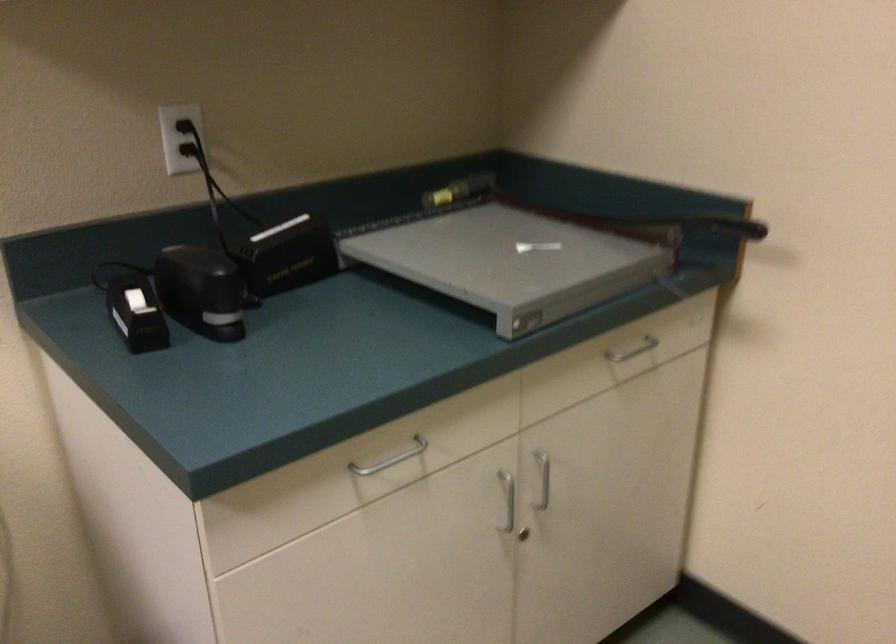
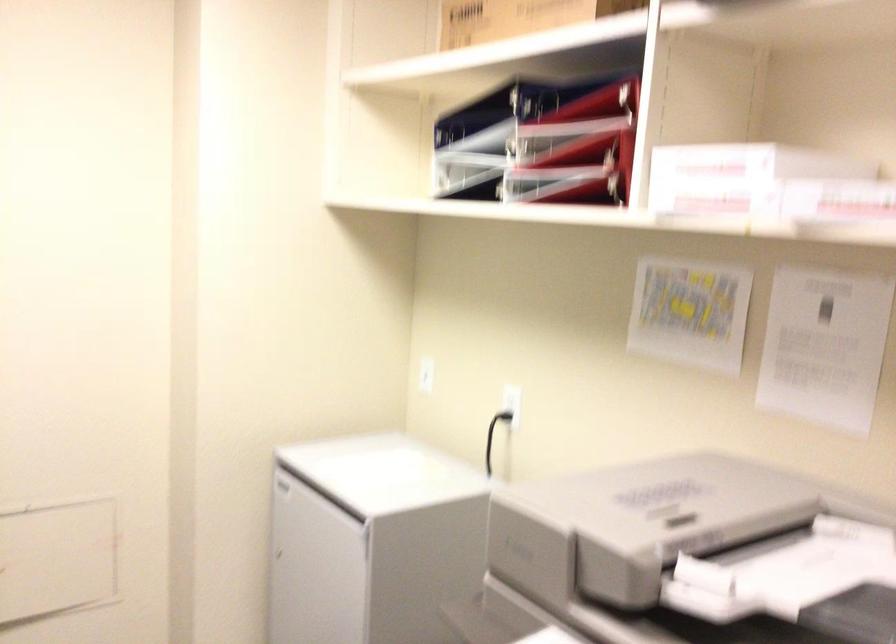
Question: The first image is from the beginning of the video and the second image is from the end. How did the camera likely rotate when shooting the video?

Choices:
 (A) Left
 (B) Right
 (C) Up
 (D) Down

Answer: (A)